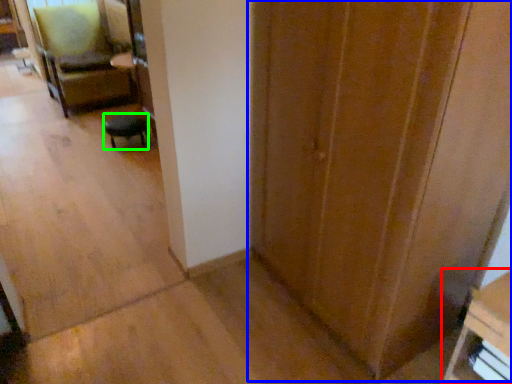
Question: Considering the real-world distances, which object is closest to furniture (highlighted by a red box)? door (highlighted by a blue box) or furniture (highlighted by a green box).

Choices:
 (A) door
 (B) furniture

Answer: (A)